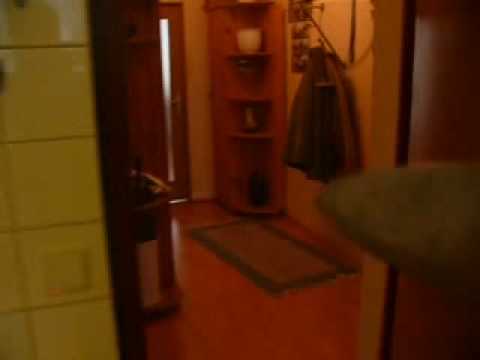
The height and width of the screenshot is (360, 480). What are the coordinates of `door` in the screenshot? It's located at tap(154, 89).